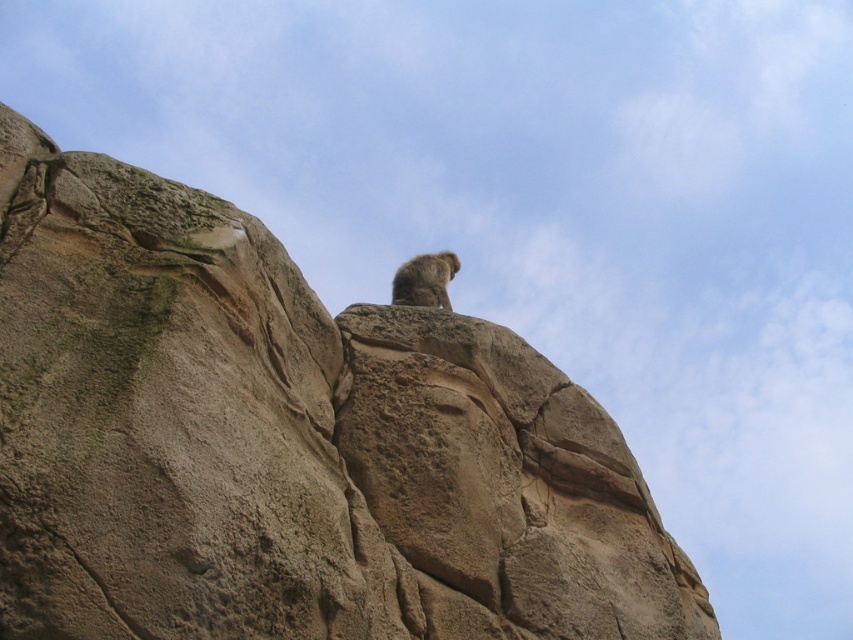
Question: Which of the following is the farthest from the observer?

Choices:
 (A) grayish-brown fur monkey at upper center
 (B) brown rough rock at upper center

Answer: (A)

Question: From the image, what is the correct spatial relationship of brown rough rock at upper center in relation to grayish-brown fur monkey at upper center?

Choices:
 (A) above
 (B) below

Answer: (B)

Question: Is brown rough rock at upper center wider than grayish-brown fur monkey at upper center?

Choices:
 (A) no
 (B) yes

Answer: (B)

Question: Can you confirm if brown rough rock at upper center is bigger than grayish-brown fur monkey at upper center?

Choices:
 (A) yes
 (B) no

Answer: (B)